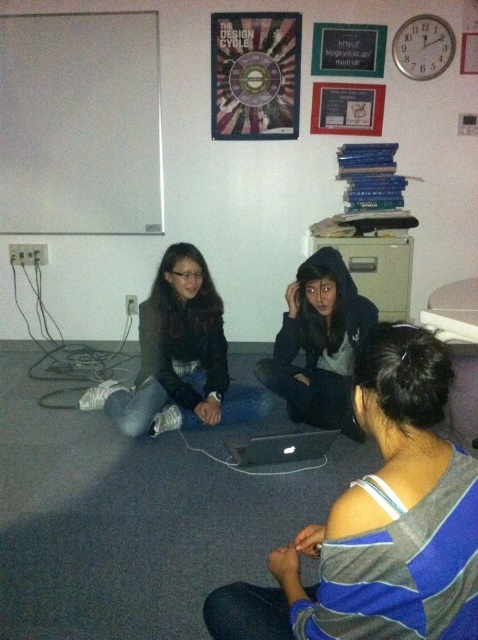
You are a photographer trying to capture a clear shot of both the matte black jacket at center and the metallic circular object at upper center. Given their height difference, which object will appear larger in the photo?

The matte black jacket at center will appear larger in the photo since it is taller than the metallic circular object at upper center.

Based on the scene description, where is the gray striped shirt at lower right located in terms of its 2D coordinates?

The gray striped shirt at lower right is located at the 2D coordinates of point (380, 522).